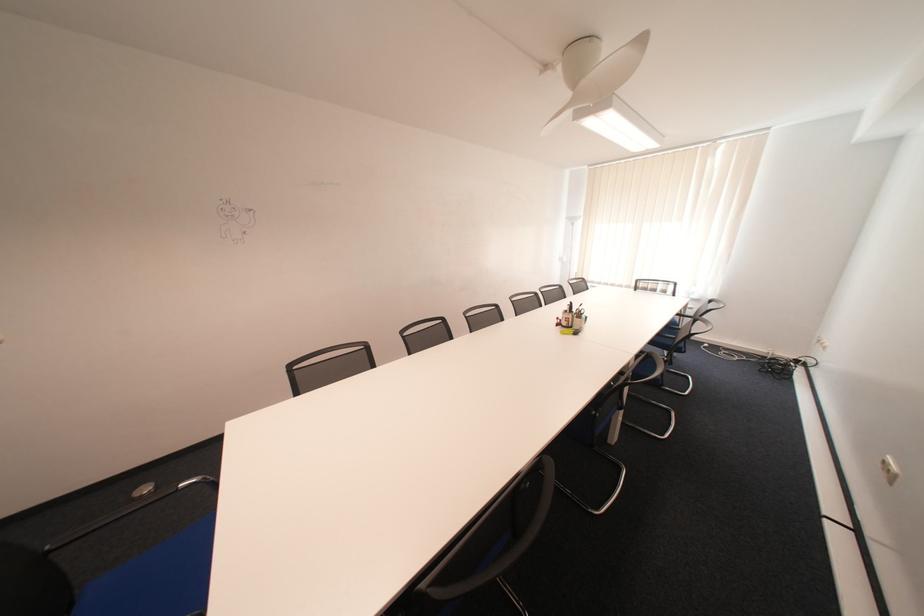
Where would you resting arm the black chair armrest? Please return your answer as a coordinate pair (x, y).

(142, 504)